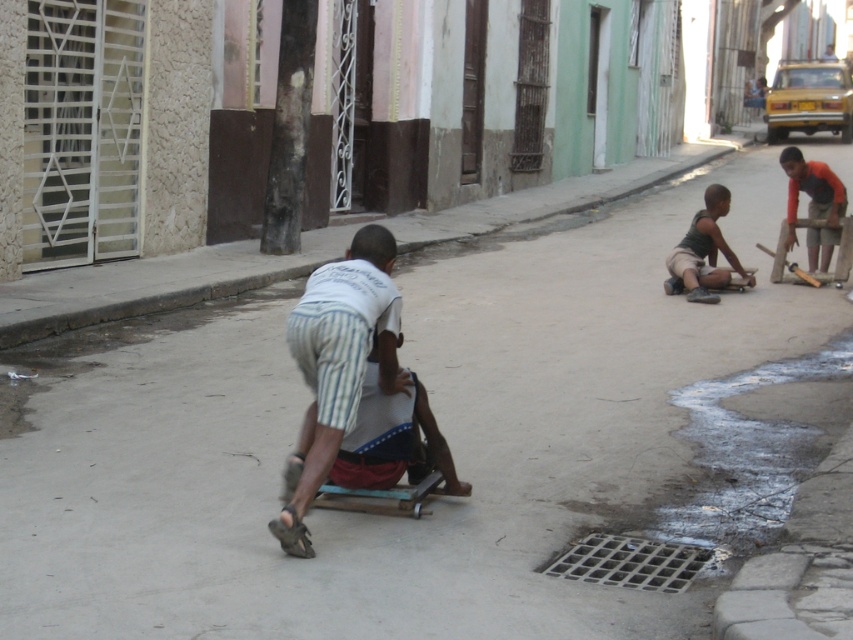
What is located at the coordinates point (703, 252) in the image?

The point (703, 252) corresponds to dark gray fabric shorts at right.

You are a photographer trying to capture a photo of the striped cotton shorts at center and the dark gray fabric shorts at right. Since you want both subjects to appear in focus, which one should you focus on first to ensure depth of field?

The striped cotton shorts at center is much taller as dark gray fabric shorts at right, so you should focus on the striped cotton shorts at center first to ensure both are in focus.

You are a tailor who needs to make a new pair of shorts for each of the two boys wearing striped cotton shorts at center and dark gray fabric shorts at right. The customer wants the new shorts to be the same width as their current ones. If you have a limited amount of fabric, which boy requires less fabric for their new shorts?

The striped cotton shorts at center requires less fabric because its width is less than that of the dark gray fabric shorts at right.